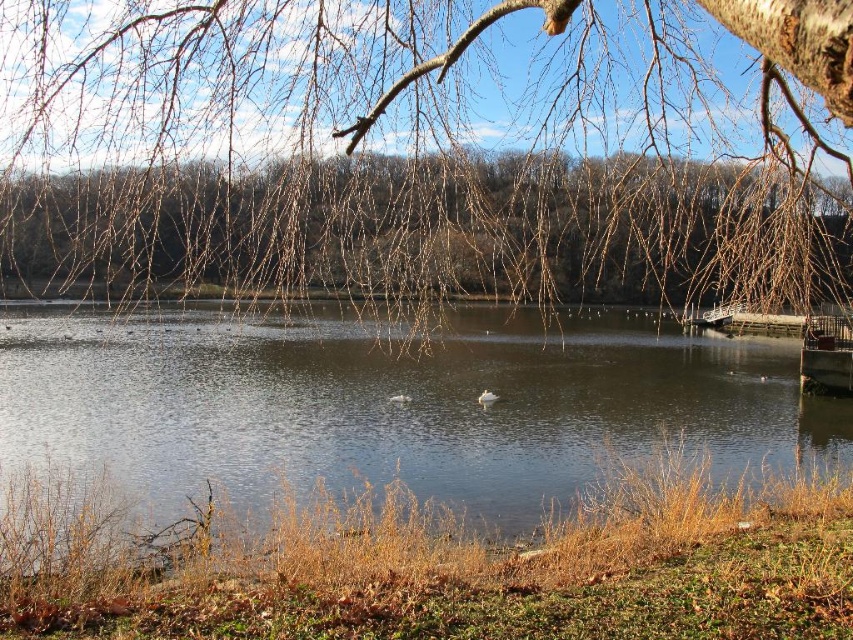
You are standing at the lakeside and see two points marked in the image. Which point, point (x=27, y=131) or point (x=822, y=323), is closer to you?

Point (x=27, y=131) is closer to the viewer than point (x=822, y=323).